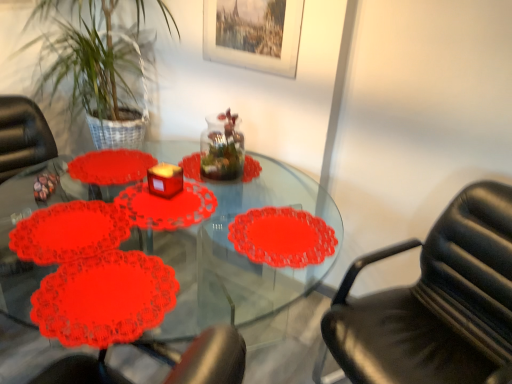
I want to click on free spot behind matte red candle at center, so click(x=176, y=174).